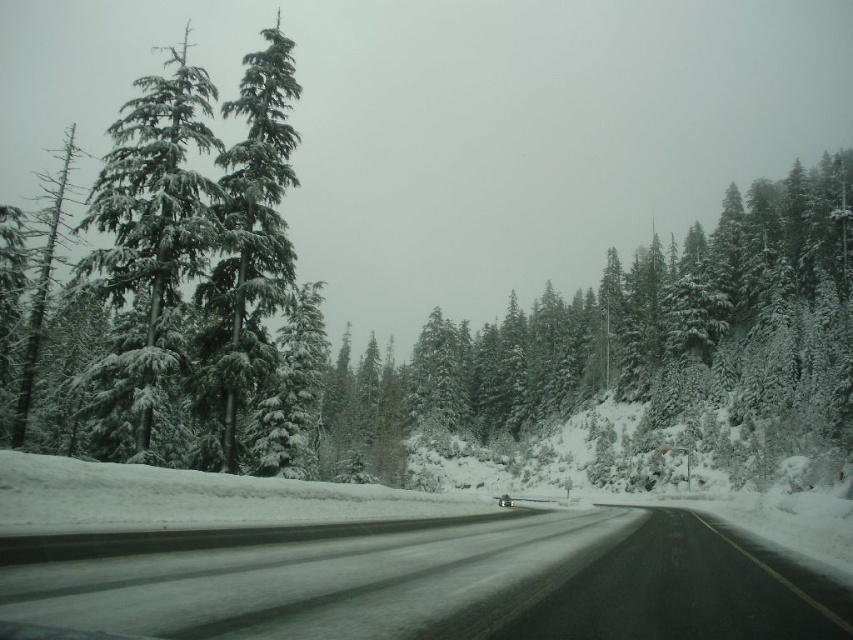
You are driving a car and looking out the window. You see a point marked at coordinates (148, 244). Based on the scene, where is this point located?

The point marked at coordinates (148, 244) is located on the snow covered evergreen at left.